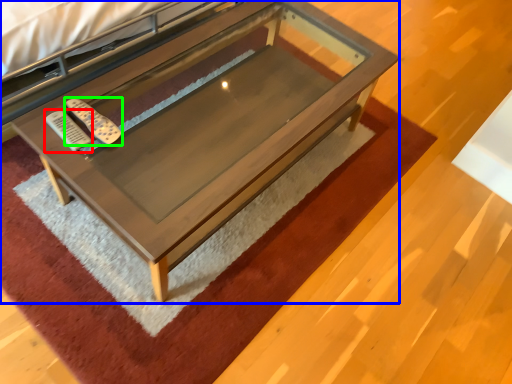
Question: Based on their relative distances, which object is nearer to remote (highlighted by a red box)? Choose from table (highlighted by a blue box) and remote (highlighted by a green box).

Choices:
 (A) table
 (B) remote

Answer: (B)